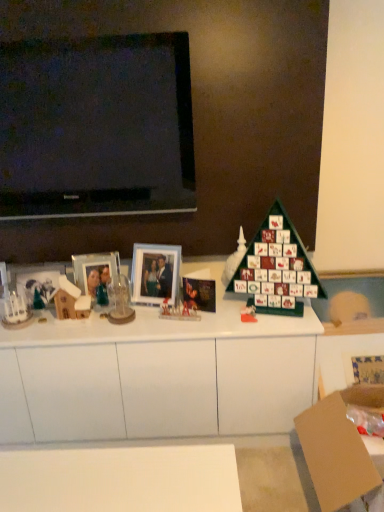
Where is `vacant area that lies to the right of translucent glass figurine at center, which appears as the third toy when viewed from the right`? This screenshot has height=512, width=384. vacant area that lies to the right of translucent glass figurine at center, which appears as the third toy when viewed from the right is located at coordinates (222, 319).